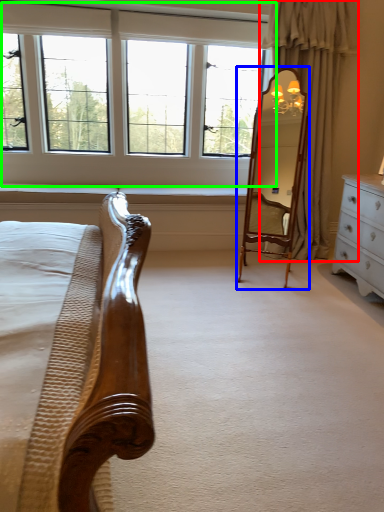
Question: Estimate the real-world distances between objects in this image. Which object is farther from curtain (highlighted by a red box), mirror (highlighted by a blue box) or window (highlighted by a green box)?

Choices:
 (A) mirror
 (B) window

Answer: (B)